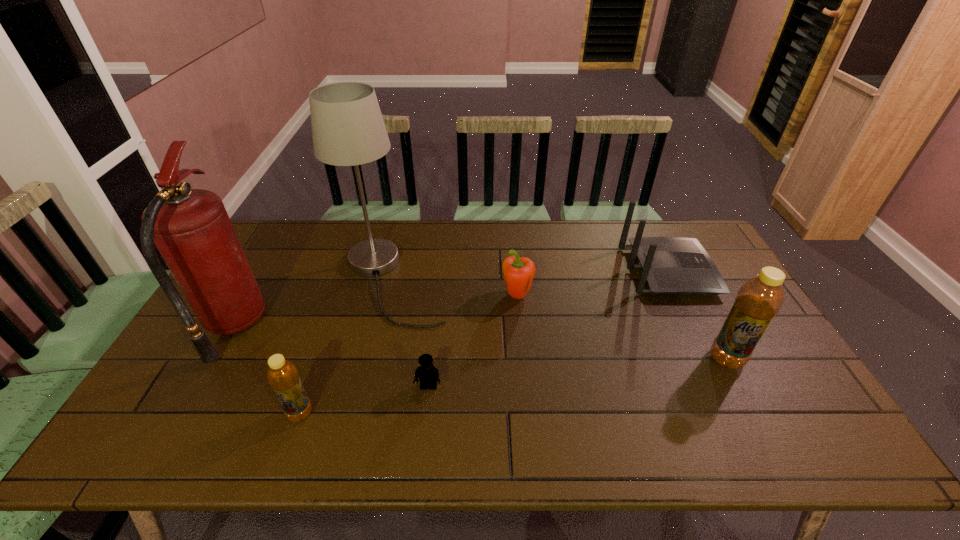
Find the location of a particular element. Image resolution: width=960 pixels, height=540 pixels. object that is the sixth closest to the router is located at coordinates (191, 228).

The height and width of the screenshot is (540, 960). I want to click on vacant space that satisfies the following two spatial constraints: 1. on the back side of the nearest object; 2. on the front-facing side of the router, so click(348, 272).

Locate an element on the screen. This screenshot has width=960, height=540. vacant region that satisfies the following two spatial constraints: 1. at the front of the left bottle where the nozzle is aimed; 2. on the right side of the fire extinguisher is located at coordinates (183, 413).

Identify the location of vacant space that satisfies the following two spatial constraints: 1. on the front side of the table lamp; 2. on the left side of the pepper. (389, 296).

The width and height of the screenshot is (960, 540). I want to click on free point that satisfies the following two spatial constraints: 1. on the back side of the table lamp; 2. on the front-facing side of the router, so point(395,272).